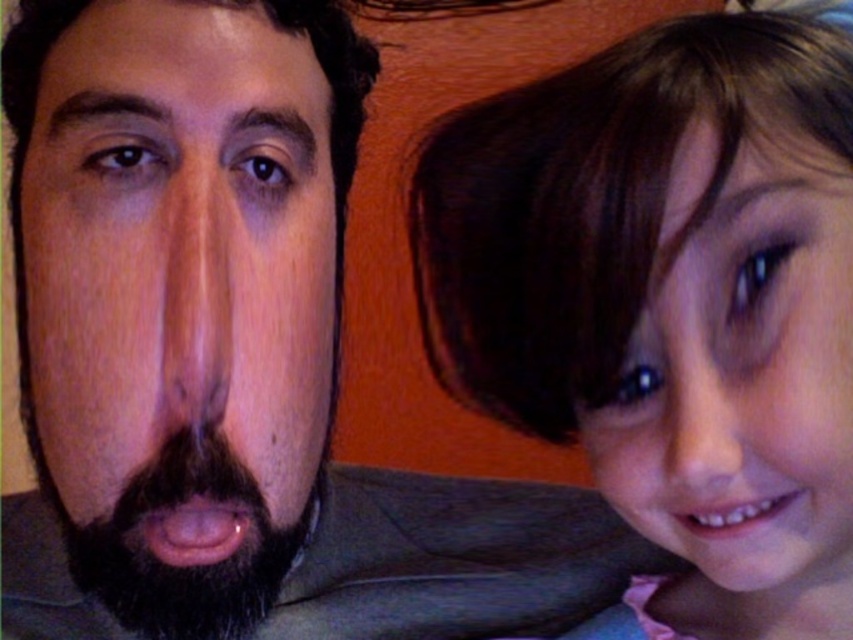
Question: Estimate the real-world distances between objects in this image. Which object is farther from the smooth brown hair at right?

Choices:
 (A) dark brown hair at upper right
 (B) smooth skin nose at center

Answer: (B)

Question: Which object appears closest to the camera in this image?

Choices:
 (A) dark brown hair at upper right
 (B) black fuzzy beard at left

Answer: (A)

Question: In this image, where is smooth brown hair at right located relative to brown hair at upper right?

Choices:
 (A) above
 (B) below

Answer: (A)

Question: Among these objects, which one is farthest from the camera?

Choices:
 (A) dark brown hair at upper right
 (B) brown hair at upper right
 (C) smooth brown hair at right

Answer: (A)

Question: Is dark brown hair at upper right above black fuzzy beard at left?

Choices:
 (A) no
 (B) yes

Answer: (B)

Question: Does dark brown hair at upper right appear under black fuzzy beard at left?

Choices:
 (A) no
 (B) yes

Answer: (A)